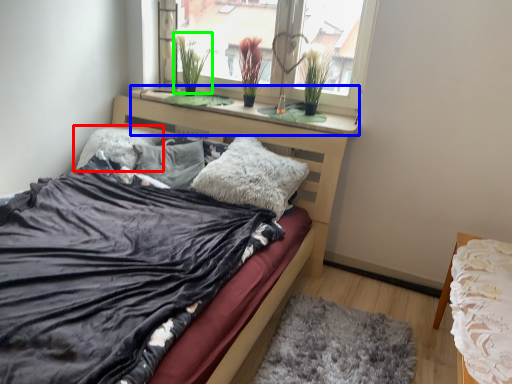
Question: Which is farther away from pillow (highlighted by a red box)? window sill (highlighted by a blue box) or plant (highlighted by a green box)?

Choices:
 (A) window sill
 (B) plant

Answer: (B)